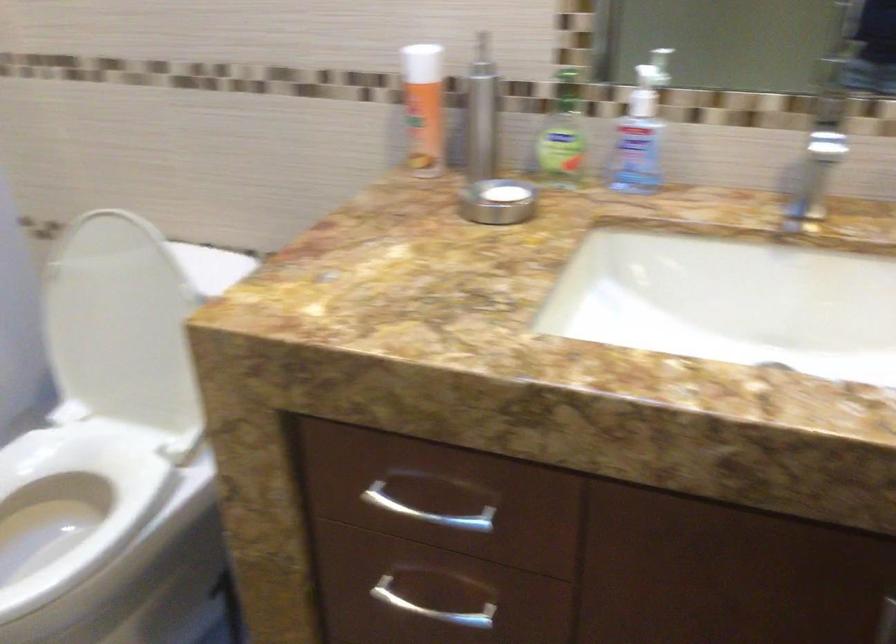
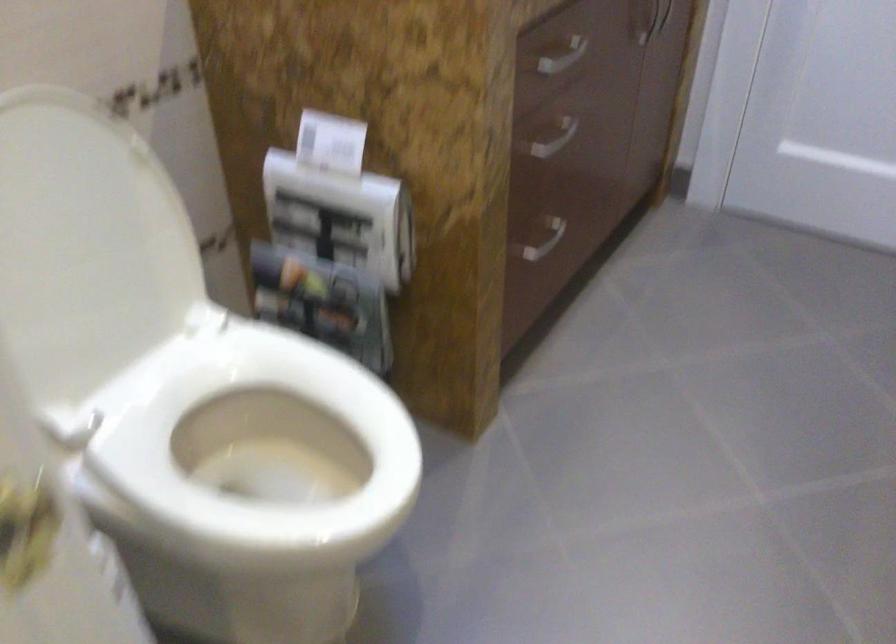
Where in the second image is the point corresponding to the point at 563,487 from the first image?

(562, 57)